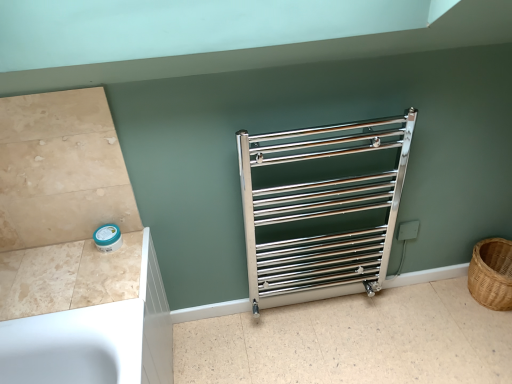
In order to click on vacant location below polished chrome towel rack at center (from a real-world perspective) in this screenshot , I will do `click(319, 308)`.